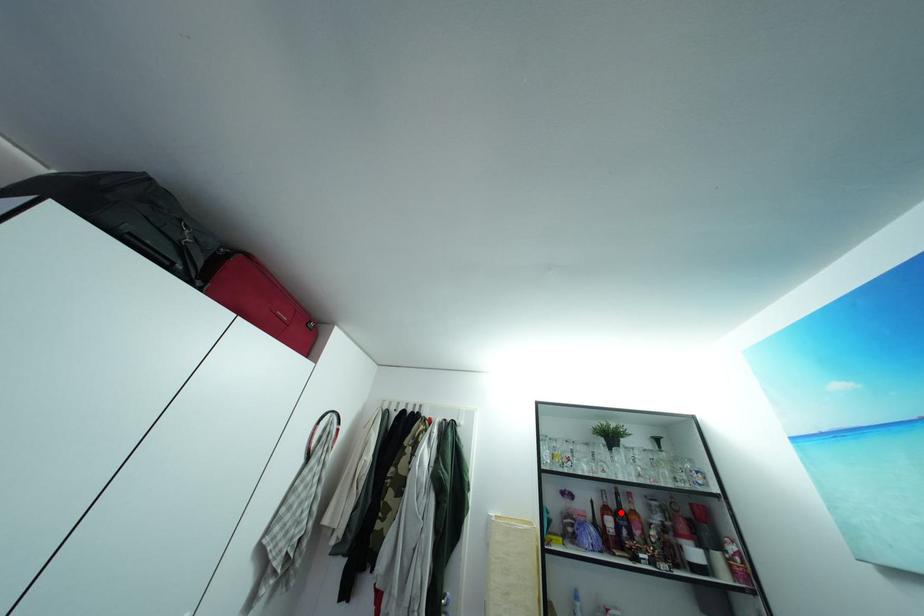
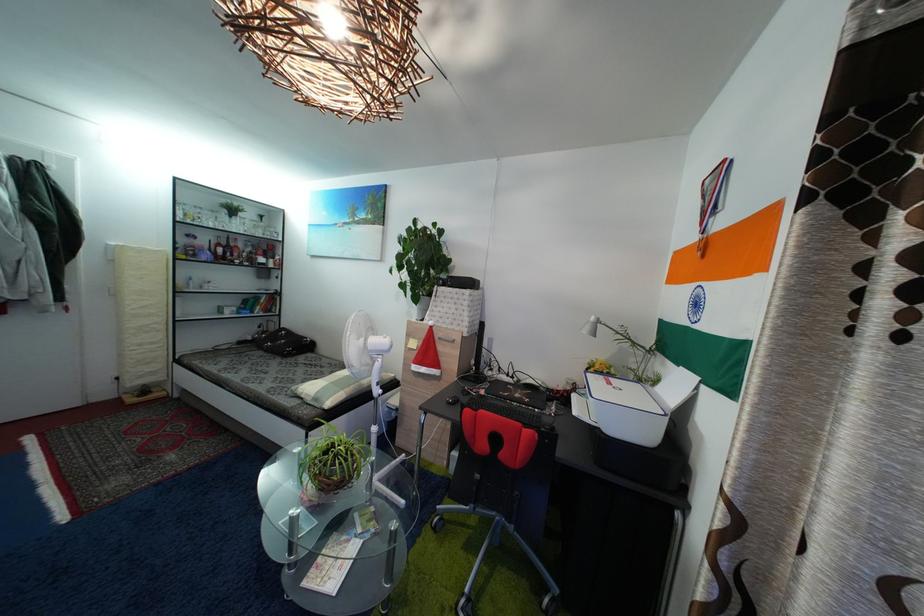
In the second image, find the point that corresponds to the highlighted location in the first image.

(233, 251)